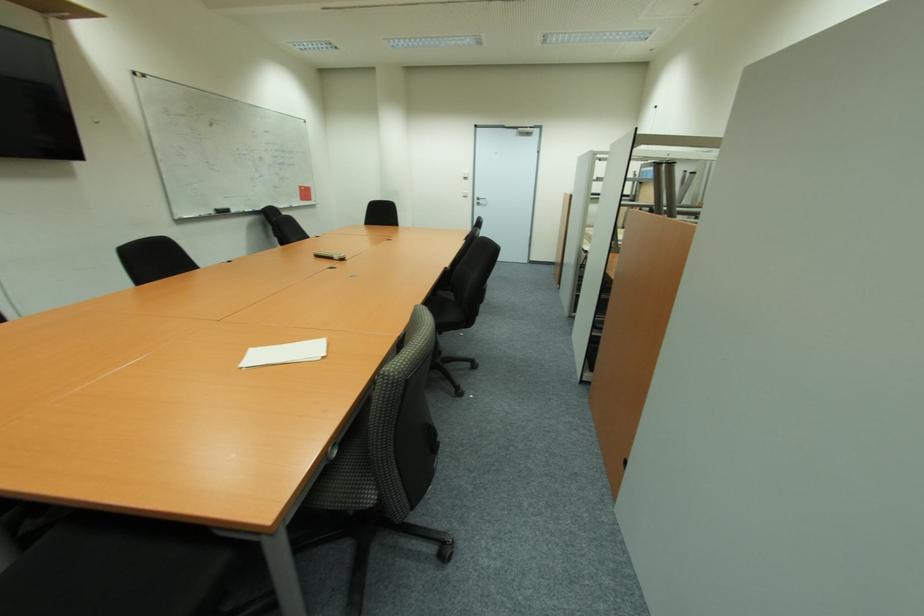
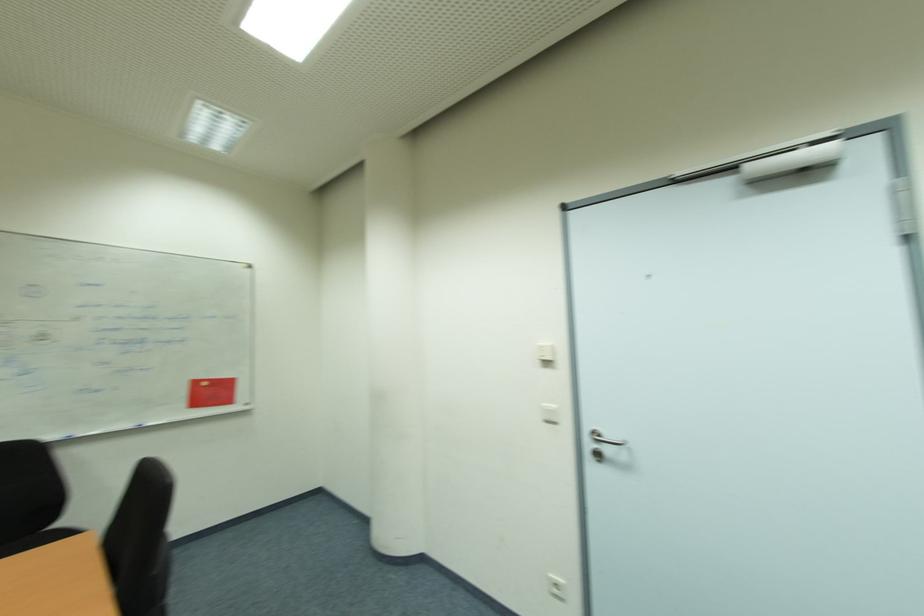
Where in the second image is the point corresponding to point 469,192 from the first image?

(556, 407)